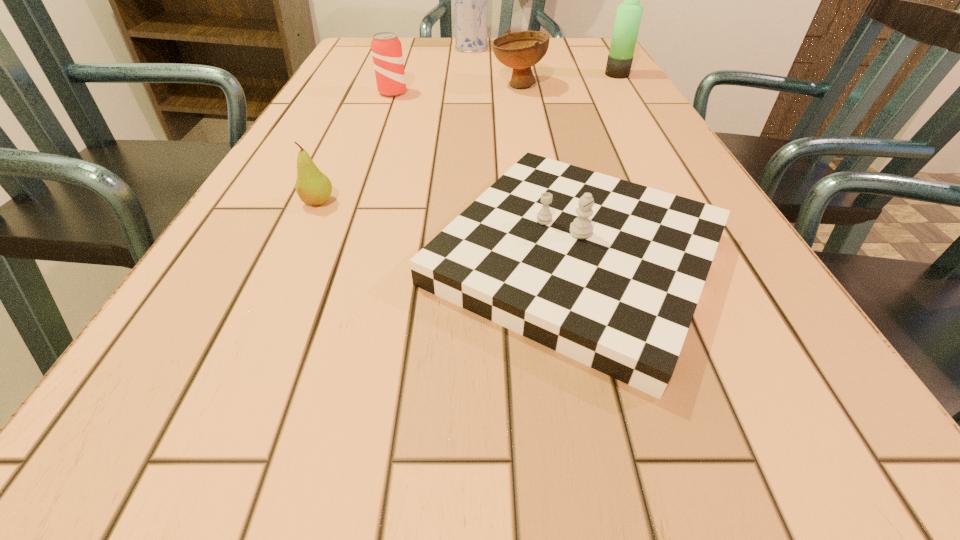
Where is `vacant space at the far right corner`? The height and width of the screenshot is (540, 960). vacant space at the far right corner is located at coordinates (603, 48).

Image resolution: width=960 pixels, height=540 pixels. Find the location of `vacant area between the aerosol can and the soup bowl`. vacant area between the aerosol can and the soup bowl is located at coordinates (494, 66).

The image size is (960, 540). Identify the location of vacant area that lies between the thermos bottle and the farthest object. (544, 61).

This screenshot has height=540, width=960. In order to click on vacant area that lies between the thermos bottle and the farthest object in this screenshot , I will do `click(544, 61)`.

This screenshot has width=960, height=540. Find the location of `blank region between the aerosol can and the beer can`. blank region between the aerosol can and the beer can is located at coordinates (432, 70).

Where is `empty location between the thermos bottle and the aerosol can`? empty location between the thermos bottle and the aerosol can is located at coordinates (544, 61).

Image resolution: width=960 pixels, height=540 pixels. I want to click on vacant point located between the thermos bottle and the beer can, so click(x=505, y=84).

The image size is (960, 540). In order to click on vacant region between the checkerboard and the aerosol can in this screenshot , I will do `click(523, 153)`.

You are a GUI agent. You are given a task and a screenshot of the screen. Output one action in this format:
    pyautogui.click(x=<x>, y=<y>)
    Task: Click on the vacant area that lies between the thermos bottle and the pear
    Image resolution: width=960 pixels, height=540 pixels.
    Given the screenshot: What is the action you would take?
    pyautogui.click(x=468, y=138)

Find the location of a particular element. free space between the beer can and the pear is located at coordinates (355, 147).